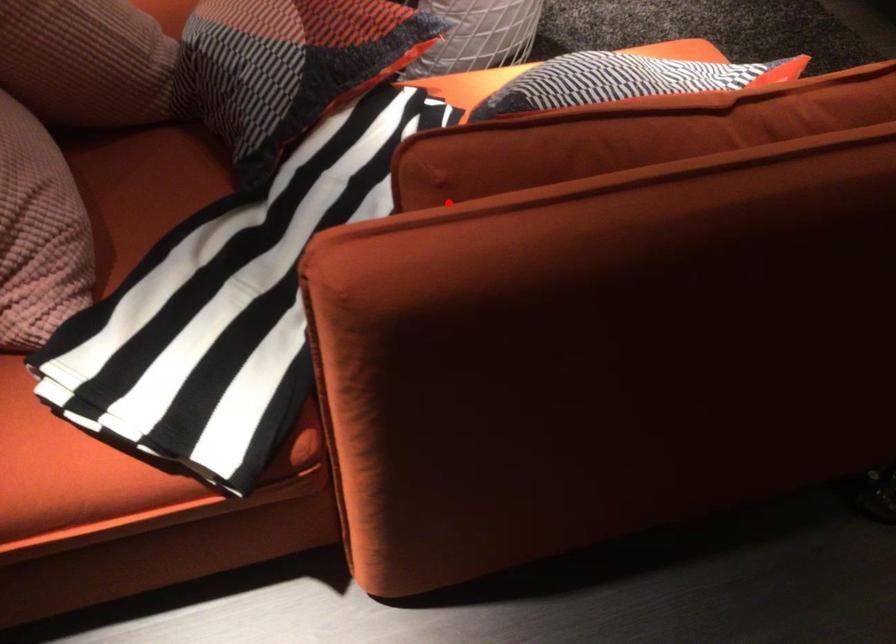
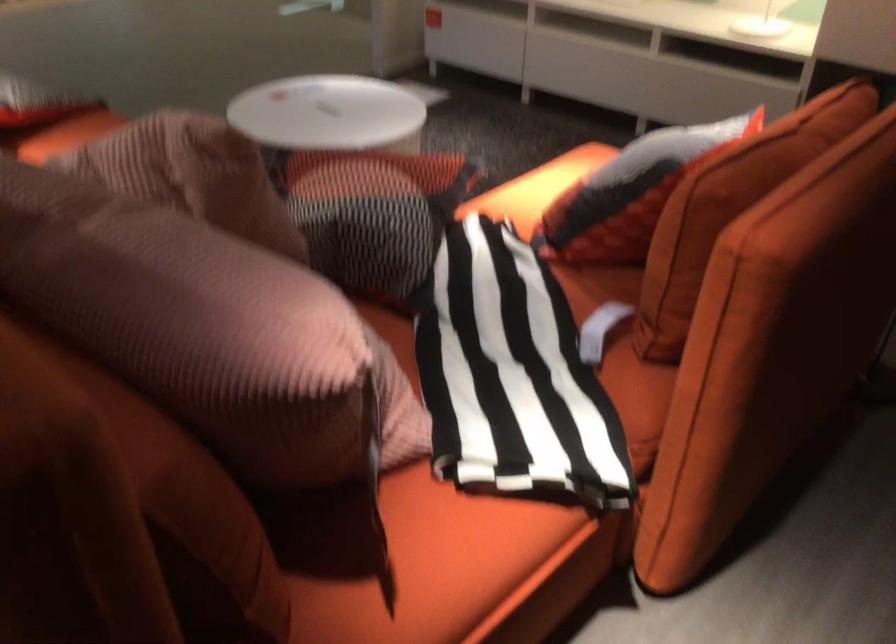
Where in the second image is the point corresponding to the highlighted location from the first image?

(730, 207)